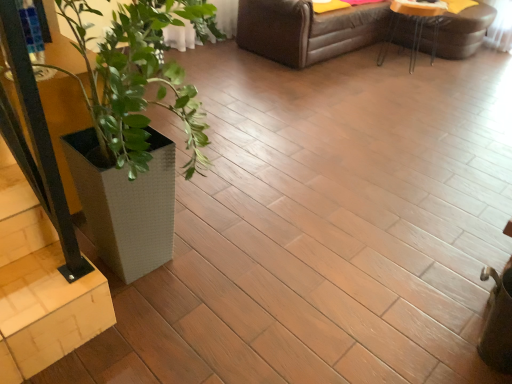
Question: Based on their positions, is white textured planter at lower left located to the left or right of light wood stairwell at lower left?

Choices:
 (A) right
 (B) left

Answer: (A)

Question: Relative to light wood stairwell at lower left, is white textured planter at lower left in front or behind?

Choices:
 (A) front
 (B) behind

Answer: (B)

Question: Which of these objects is positioned closest to the wooden table at upper right?

Choices:
 (A) white textured planter at left
 (B) white textured planter at lower left
 (C) light wood stairwell at lower left

Answer: (A)

Question: Which of these objects is positioned farthest from the light wood stairwell at lower left?

Choices:
 (A) white textured planter at left
 (B) wooden table at upper right
 (C) white textured planter at lower left

Answer: (B)